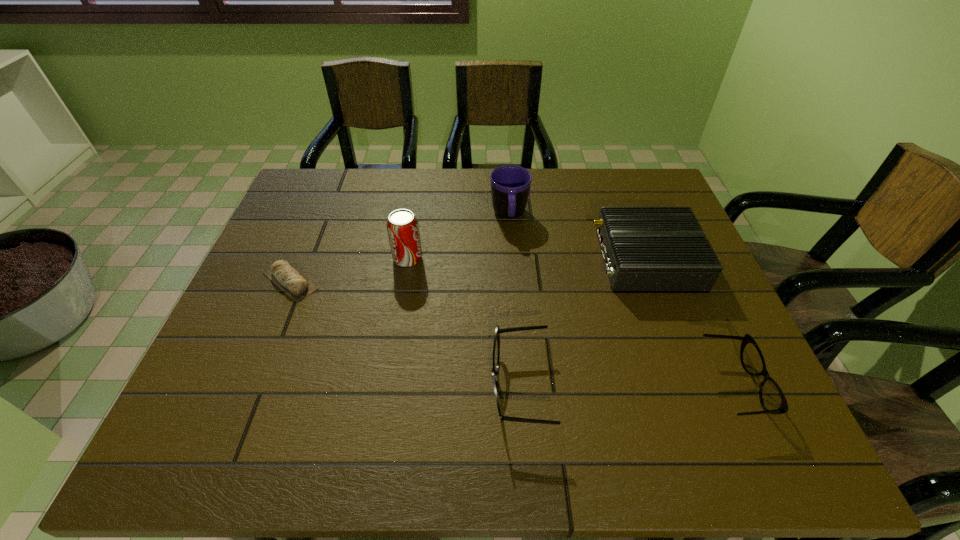
Please point a free position for a spectacles on the left. Please provide its 2D coordinates. Your answer should be formatted as a tuple, i.e. [(x, y)], where the tuple contains the x and y coordinates of a point satisfying the conditions above.

[(305, 389)]